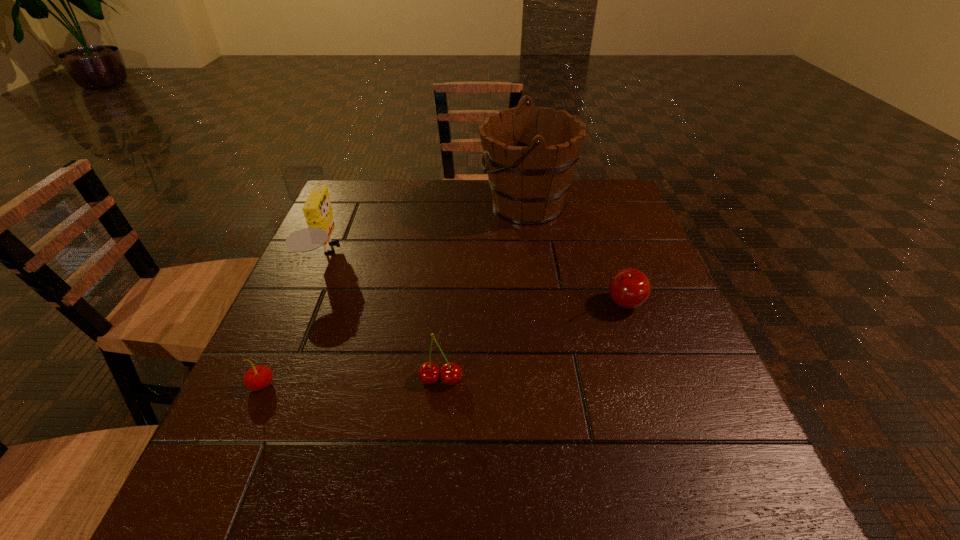
Point out which cherry is positioned as the nearest to the second tallest object. Please provide its 2D coordinates. Your answer should be formatted as a tuple, i.e. [(x, y)], where the tuple contains the x and y coordinates of a point satisfying the conditions above.

[(257, 378)]

The image size is (960, 540). Find the location of `free point that satisfies the following two spatial constraints: 1. with the handle on the rightmost cherry; 2. on the right side of the tallest object`. free point that satisfies the following two spatial constraints: 1. with the handle on the rightmost cherry; 2. on the right side of the tallest object is located at coordinates (540, 303).

The width and height of the screenshot is (960, 540). What are the coordinates of `vacant region that satisfies the following two spatial constraints: 1. on the front-facing side of the sponge; 2. on the front side of the leftmost cherry` in the screenshot? It's located at (271, 384).

Where is `free space that satisfies the following two spatial constraints: 1. with the handle on the wine bucket; 2. with the stems of the third object from right to left pointing upwards`? This screenshot has width=960, height=540. free space that satisfies the following two spatial constraints: 1. with the handle on the wine bucket; 2. with the stems of the third object from right to left pointing upwards is located at coordinates (551, 380).